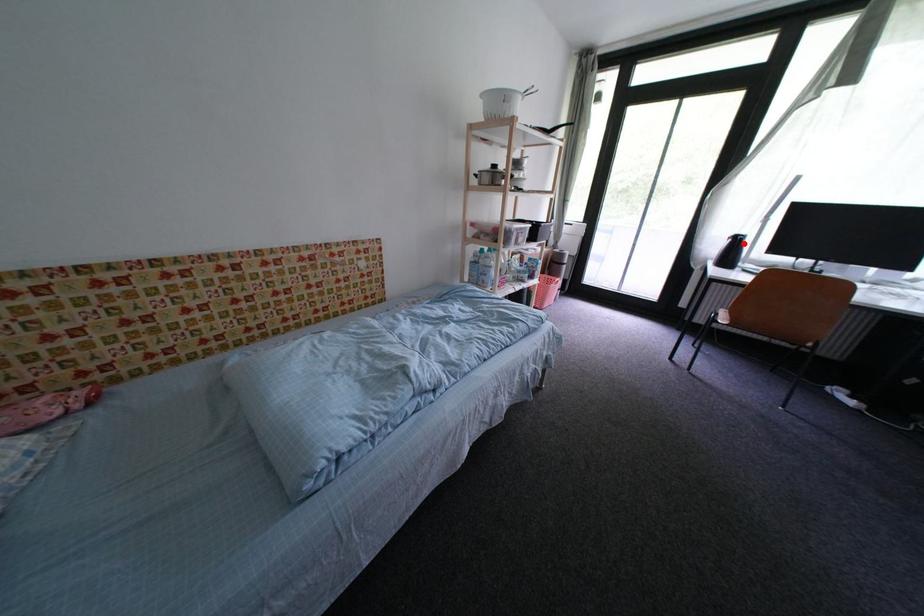
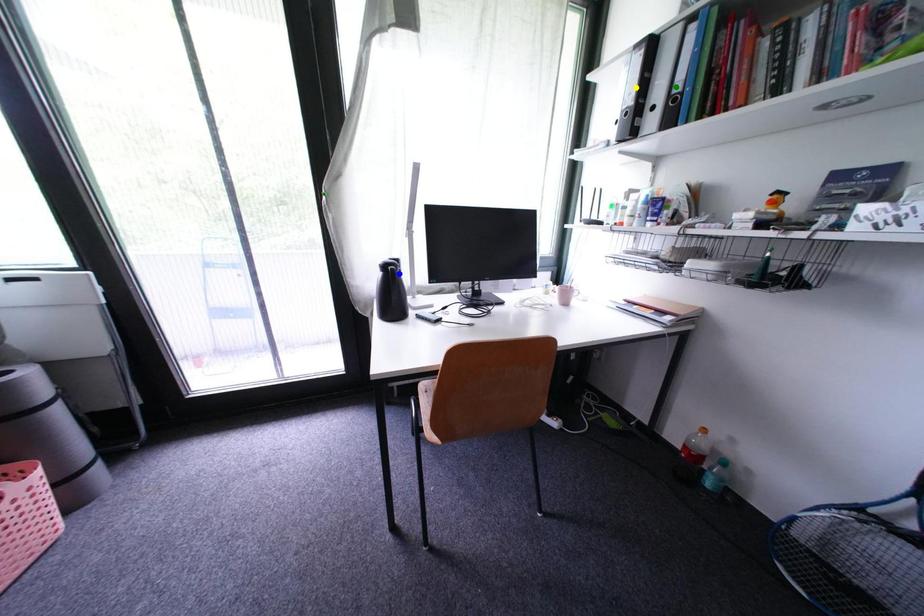
Question: I am providing you with two images of the same scene from different viewpoints. A red point is marked on the first image. You are given multiple points on the second image. Which mark in image 2 goes with the point in image 1?

Choices:
 (A) green point
 (B) blue point
 (C) yellow point

Answer: (B)